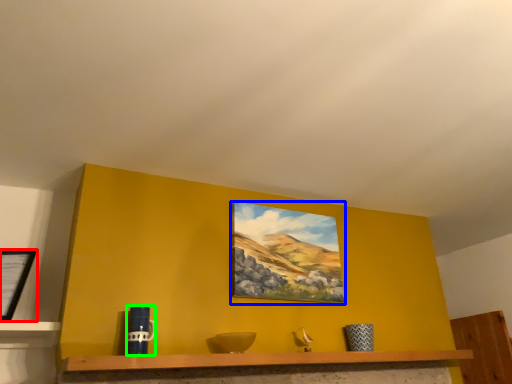
Question: Which object is positioned farthest from picture frame (highlighted by a red box)? Select from picture frame (highlighted by a blue box) and mug (highlighted by a green box).

Choices:
 (A) picture frame
 (B) mug

Answer: (A)